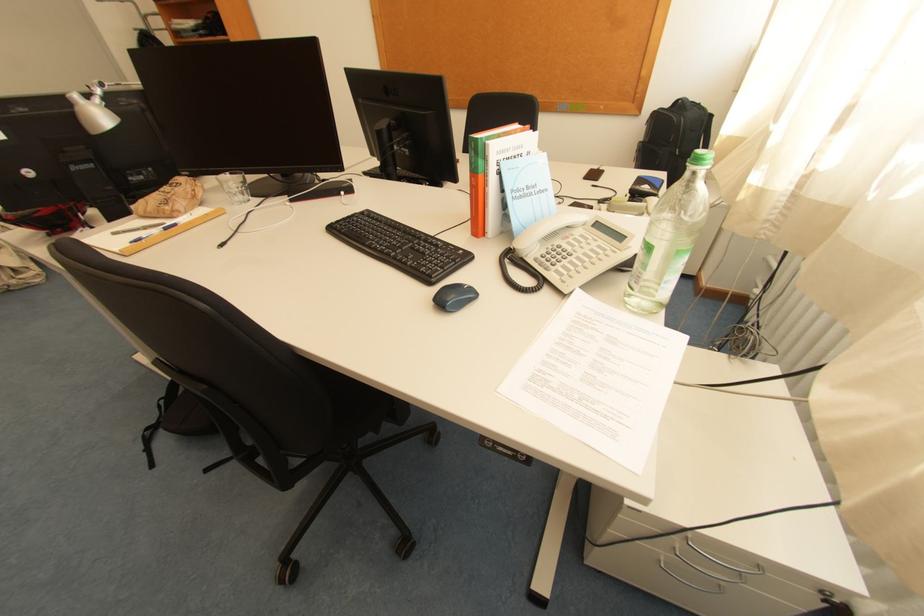
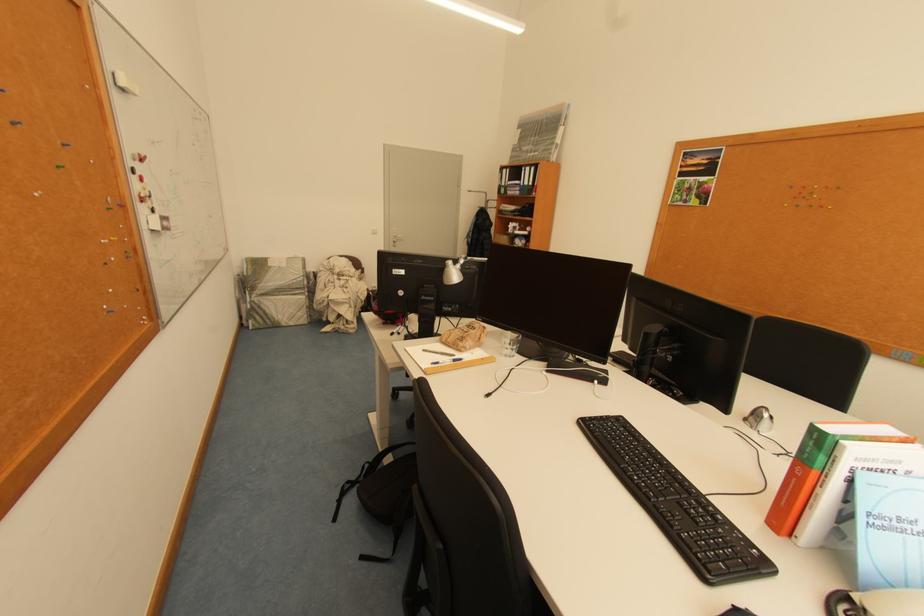
In the second image, find the point that corresponds to point 356,219 in the first image.

(610, 419)